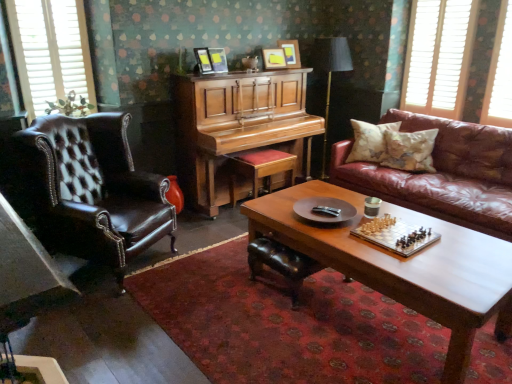
At what (x,y) coordinates should I click in order to perform the action: click on free space in front of brown leather wingback chair at left. Please return your answer as a coordinate pair (x, y). The image size is (512, 384). Looking at the image, I should click on (119, 328).